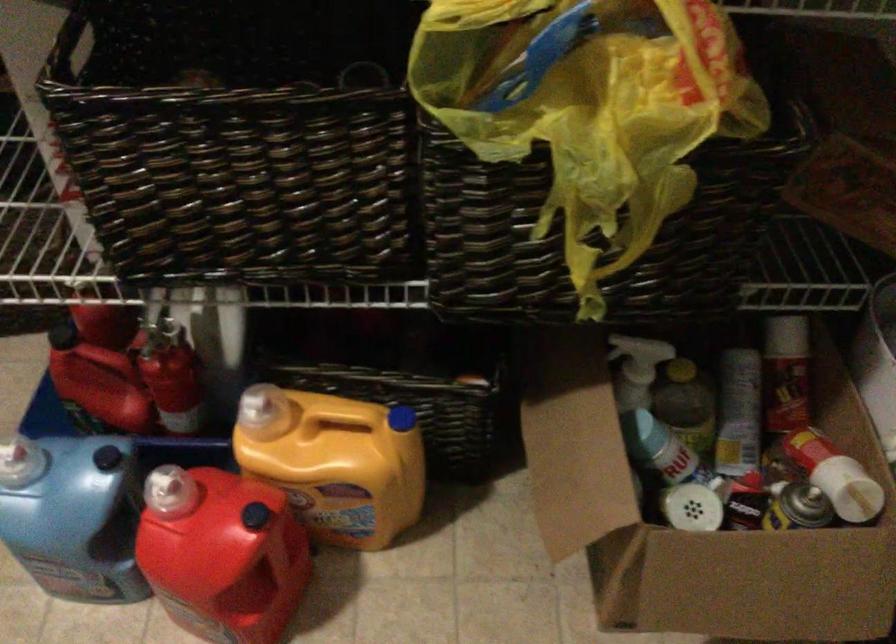
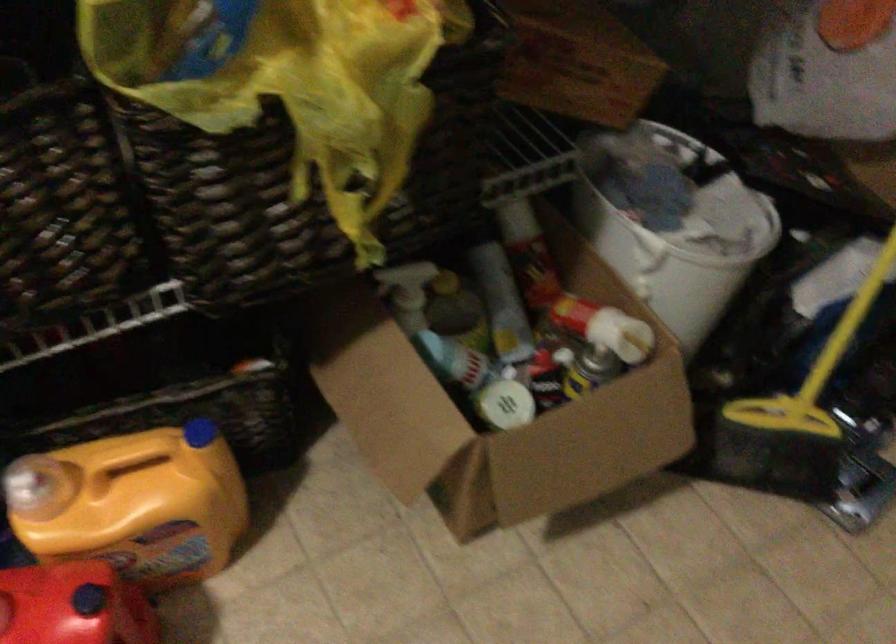
In the second image, find the point that corresponds to (x=325, y=455) in the first image.

(133, 504)